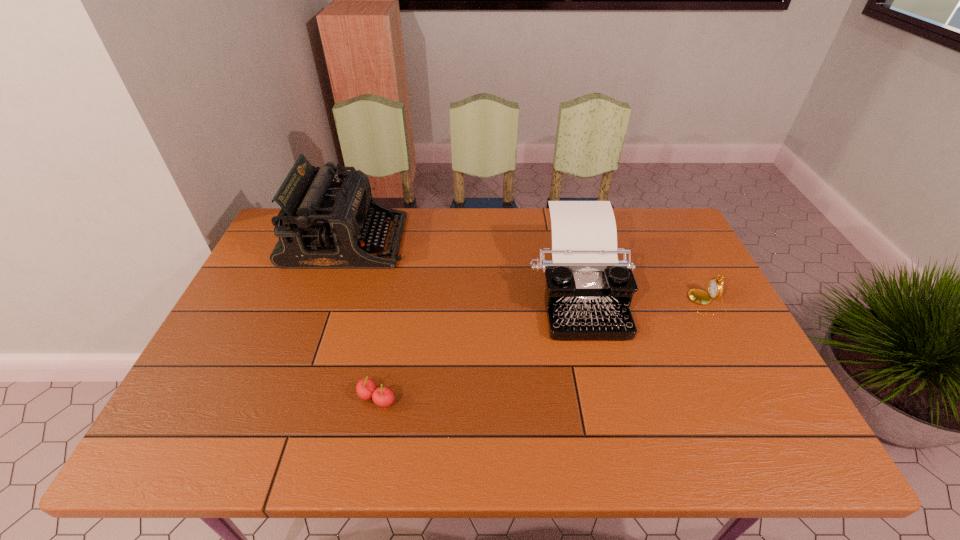
Where is `blank region between the shortest object and the second object from right to left`? The image size is (960, 540). blank region between the shortest object and the second object from right to left is located at coordinates (477, 345).

Find the location of `free spot between the rightmost object and the second object from right to left`. free spot between the rightmost object and the second object from right to left is located at coordinates pyautogui.click(x=641, y=297).

Where is `empty space that is in between the left typewriter and the third object from left to right`? The width and height of the screenshot is (960, 540). empty space that is in between the left typewriter and the third object from left to right is located at coordinates (462, 266).

This screenshot has width=960, height=540. I want to click on unoccupied position between the second tallest object and the nearest object, so click(x=477, y=345).

This screenshot has width=960, height=540. Find the location of `free space between the pocket watch and the shortest object`. free space between the pocket watch and the shortest object is located at coordinates (541, 350).

This screenshot has height=540, width=960. Identify the location of free space between the tallest object and the right typewriter. (462, 266).

You are a GUI agent. You are given a task and a screenshot of the screen. Output one action in this format:
    pyautogui.click(x=<x>, y=<y>)
    Task: Click on the vacant space that is in between the nearest object and the shorter typewriter
    
    Given the screenshot: What is the action you would take?
    pyautogui.click(x=477, y=345)

Identify the location of free space between the tallest object and the second tallest object. (462, 266).

Image resolution: width=960 pixels, height=540 pixels. I want to click on unoccupied area between the pocket watch and the right typewriter, so click(x=641, y=297).

Locate an element on the screen. Image resolution: width=960 pixels, height=540 pixels. vacant area that lies between the second tallest object and the taller typewriter is located at coordinates (462, 266).